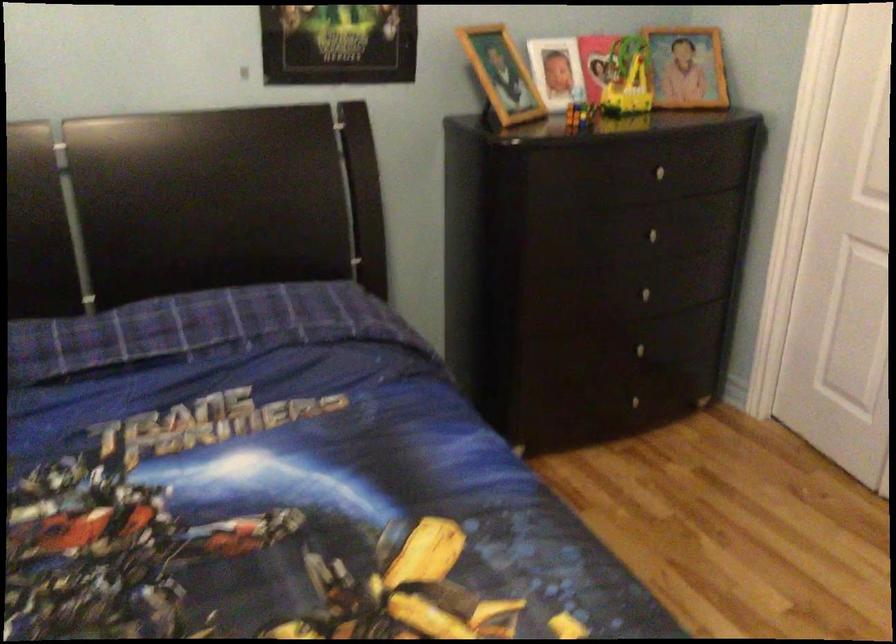
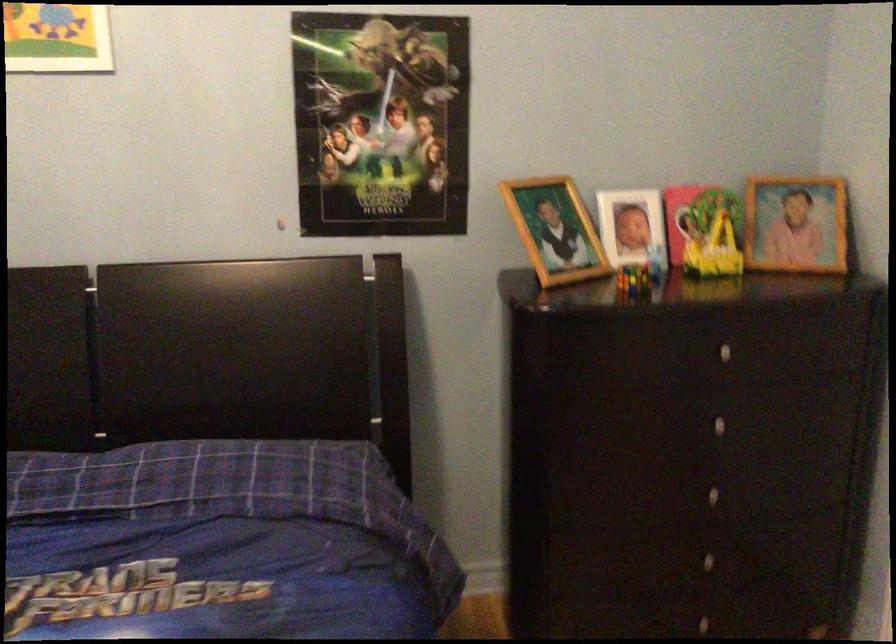
Locate, in the second image, the point that corresponds to point 633,80 in the first image.

(719, 240)